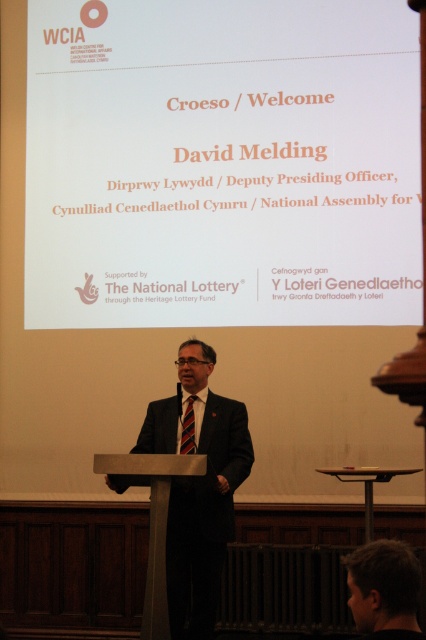
You are attending the event and need to read the white paper at upper center from where you are standing. The screen is 7.43 meters away. Can you read the text clearly?

The white paper at upper center is 7.43 meters away from the camera, so it might be difficult to read the text clearly from that distance unless you have good eyesight or use visual aids.

You are attending a formal event and see a man at the center wearing a black suit. Can you tell me where exactly the point at coordinate (198, 488) is located on his attire?

The point at coordinate (198, 488) is located on the black suit at center.